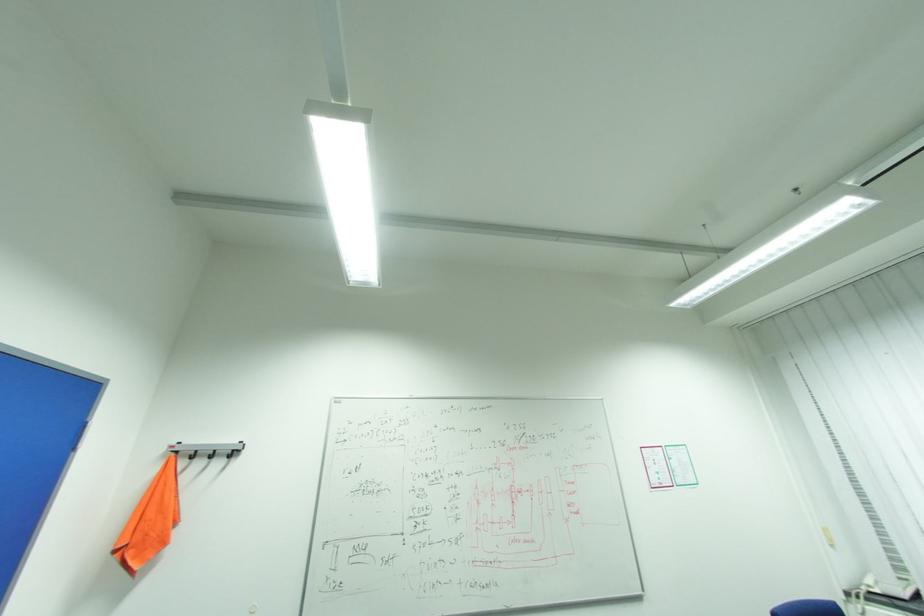
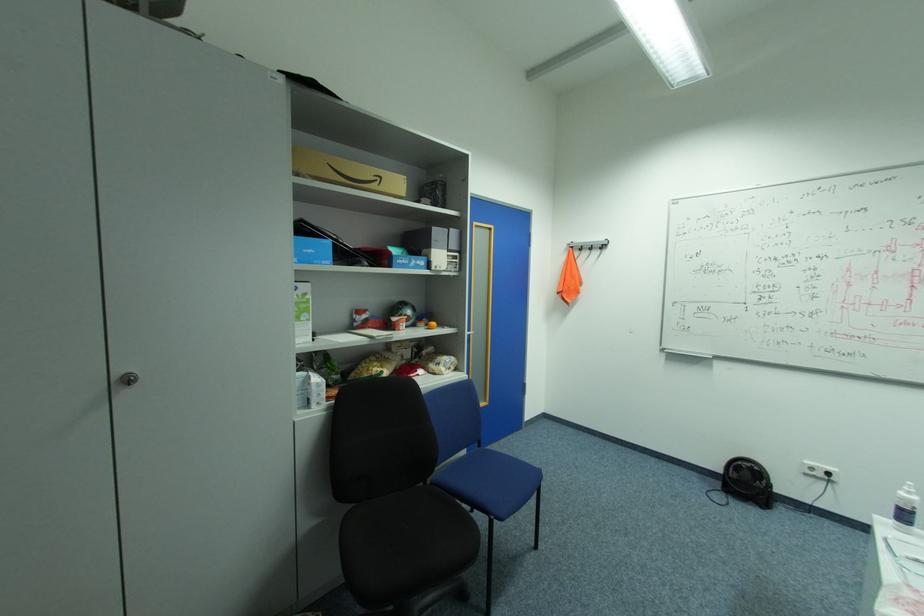
In the second image, find the point that corresponds to (x=200, y=456) in the first image.

(588, 249)